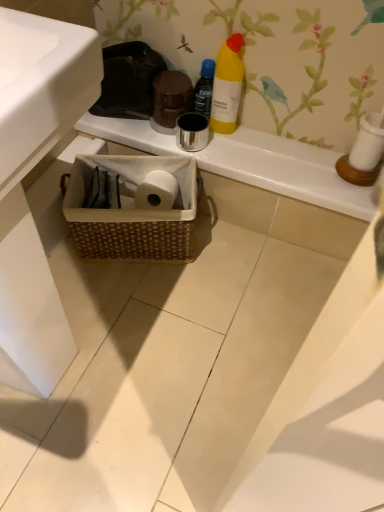
The width and height of the screenshot is (384, 512). Find the location of `blank space situated above woven basket at center (from a real-world perspective)`. blank space situated above woven basket at center (from a real-world perspective) is located at coordinates (258, 146).